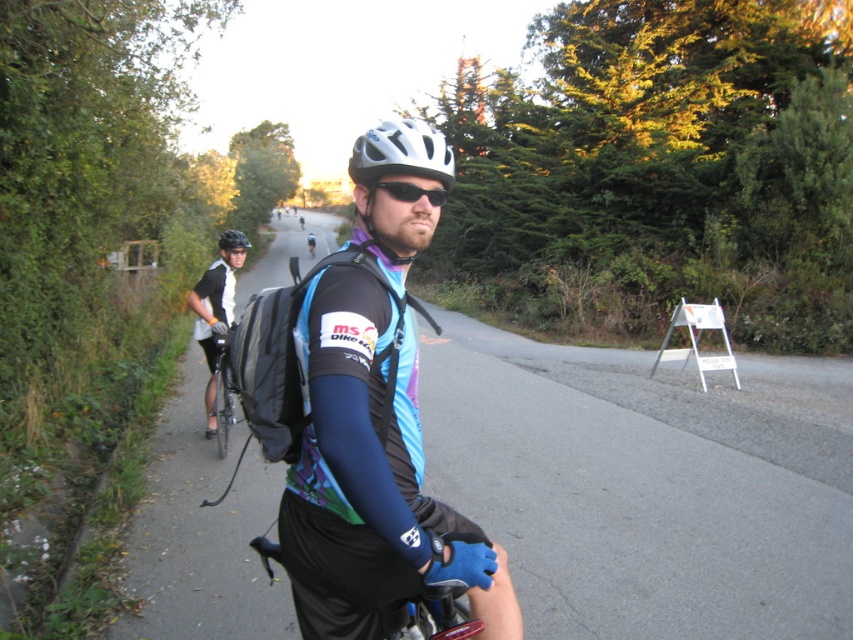
You are a cyclist approaching the road shown in the image. There is a matte black cycling jersey at center located at point (370, 480). If you want to pick up the matte black cycling jersey at center, which direction should you turn to face it?

The matte black cycling jersey at center is located at point (370, 480), so you should turn to face the center of the image to reach it.

You are a photographer trying to capture the cyclist in the image. You want to focus on the white matte bicycle helmet at center and the black matte cycling jersey at center. Which object should you adjust your camera focus on first if you want to ensure both are in focus?

The white matte bicycle helmet at center is closer to the viewer than the black matte cycling jersey at center. To ensure both are in focus, you should focus on the black matte cycling jersey at center first, as it is further away, allowing the depth of field to cover the closer helmet.